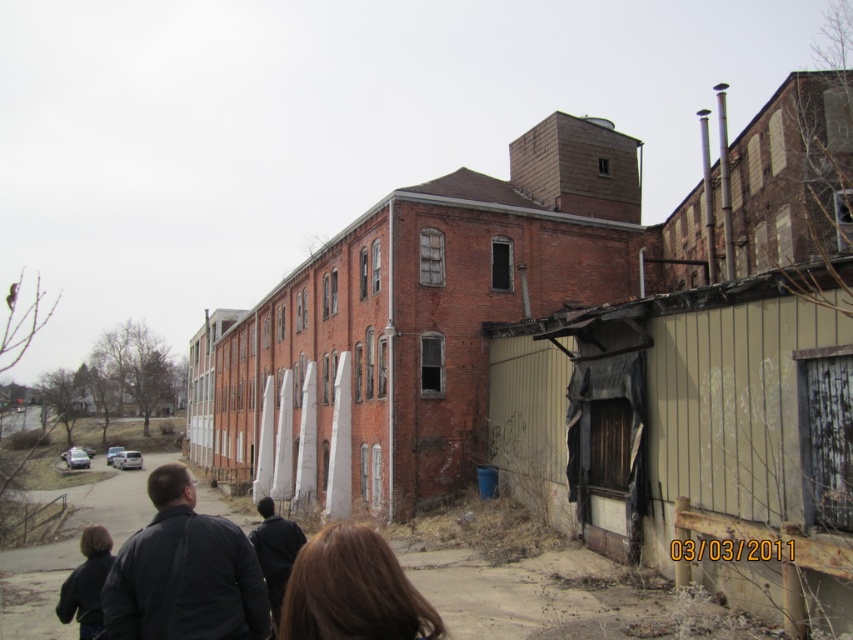
Can you confirm if brown hair at lower center is smaller than dark brown leather jacket at lower left?

Yes, brown hair at lower center is smaller than dark brown leather jacket at lower left.

Can you confirm if brown hair at lower center is positioned below dark brown leather jacket at lower left?

Incorrect, brown hair at lower center is not positioned below dark brown leather jacket at lower left.

Does point (416, 611) come closer to viewer compared to point (103, 566)?

Yes, point (416, 611) is in front of point (103, 566).

Where is `brown hair at lower center`? This screenshot has width=853, height=640. brown hair at lower center is located at coordinates (352, 589).

Is dark gray jacket at lower left closer to the viewer compared to dark blue jacket at lower center?

Yes, dark gray jacket at lower left is closer to the viewer.

Which is below, dark gray jacket at lower left or dark blue jacket at lower center?

dark blue jacket at lower center is below.

The width and height of the screenshot is (853, 640). Identify the location of dark gray jacket at lower left. (184, 572).

Find the location of a particular element. dark gray jacket at lower left is located at coordinates [x=184, y=572].

Between dark gray jacket at lower left and brown hair at lower center, which one appears on the right side from the viewer's perspective?

brown hair at lower center

This screenshot has height=640, width=853. What do you see at coordinates (184, 572) in the screenshot? I see `dark gray jacket at lower left` at bounding box center [184, 572].

I want to click on dark gray jacket at lower left, so click(184, 572).